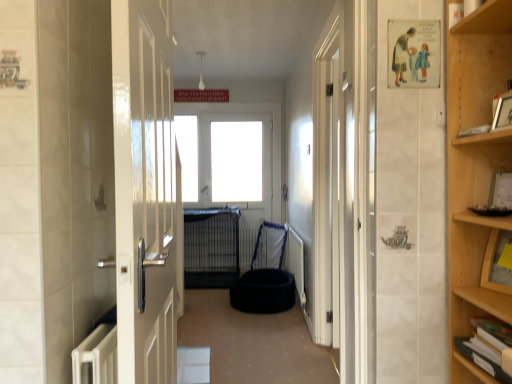
Question: Is white glossy window at center far away from white glossy door at center?

Choices:
 (A) yes
 (B) no

Answer: (A)

Question: Is white glossy window at center bigger than white glossy door at center?

Choices:
 (A) yes
 (B) no

Answer: (A)

Question: From the image's perspective, is white glossy window at center on white glossy door at center?

Choices:
 (A) no
 (B) yes

Answer: (B)

Question: Considering the relative sizes of white glossy window at center and white glossy door at center in the image provided, is white glossy window at center thinner than white glossy door at center?

Choices:
 (A) yes
 (B) no

Answer: (B)

Question: Can you confirm if white glossy window at center is shorter than white glossy door at center?

Choices:
 (A) yes
 (B) no

Answer: (A)

Question: Is white glossy window at center placed right next to white glossy door at center?

Choices:
 (A) yes
 (B) no

Answer: (B)

Question: Can you confirm if black fabric bean bag at center is positioned to the left of white glossy window at center?

Choices:
 (A) no
 (B) yes

Answer: (A)

Question: Does black fabric bean bag at center touch white glossy window at center?

Choices:
 (A) yes
 (B) no

Answer: (B)

Question: Is black fabric bean bag at center outside white glossy window at center?

Choices:
 (A) no
 (B) yes

Answer: (B)

Question: Does black fabric bean bag at center have a lesser height compared to white glossy window at center?

Choices:
 (A) no
 (B) yes

Answer: (B)

Question: From a real-world perspective, does black fabric bean bag at center stand above white glossy window at center?

Choices:
 (A) no
 (B) yes

Answer: (A)

Question: Considering the relative sizes of black fabric bean bag at center and white glossy window at center in the image provided, is black fabric bean bag at center bigger than white glossy window at center?

Choices:
 (A) no
 (B) yes

Answer: (A)

Question: Can you confirm if dark blue plush dog bed at center is positioned to the left of wooden picture frame at upper right?

Choices:
 (A) yes
 (B) no

Answer: (A)